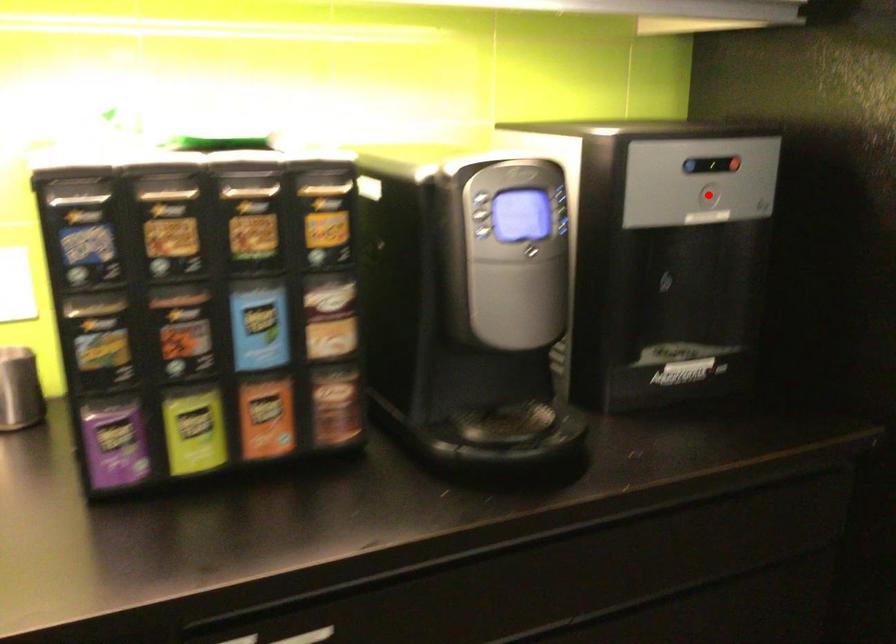
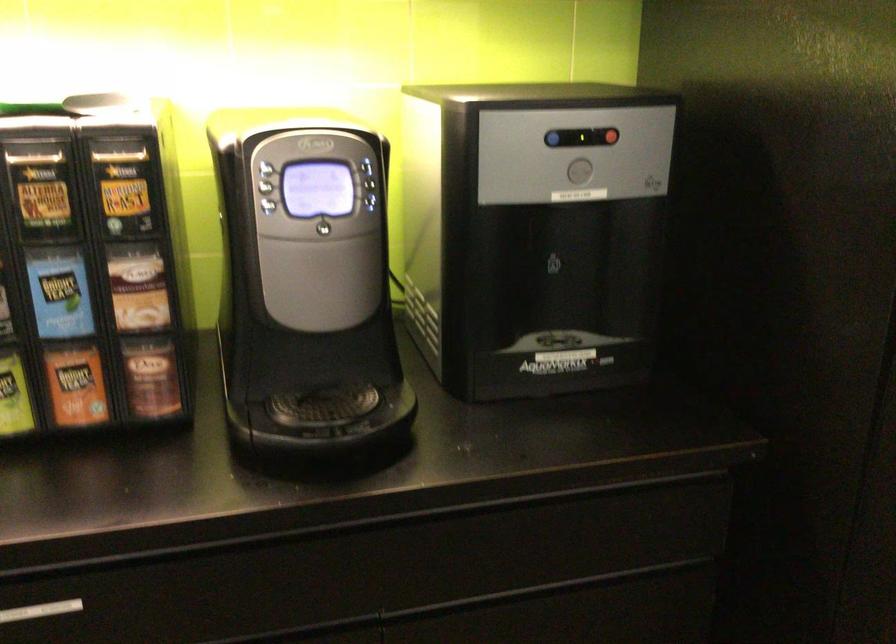
Find the pixel in the second image that matches the highlighted location in the first image.

(579, 172)